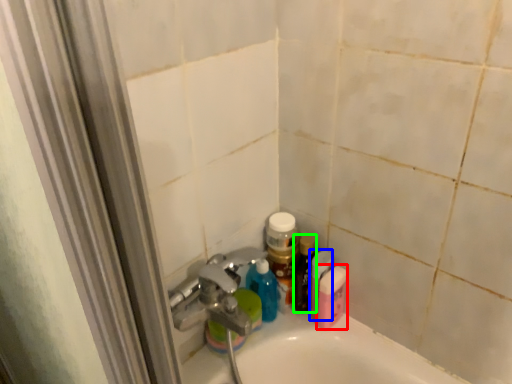
Question: Estimate the real-world distances between objects in this image. Which object is farther from mouthwash (highlighted by a red box), mouthwash (highlighted by a blue box) or toiletry (highlighted by a green box)?

Choices:
 (A) mouthwash
 (B) toiletry

Answer: (B)